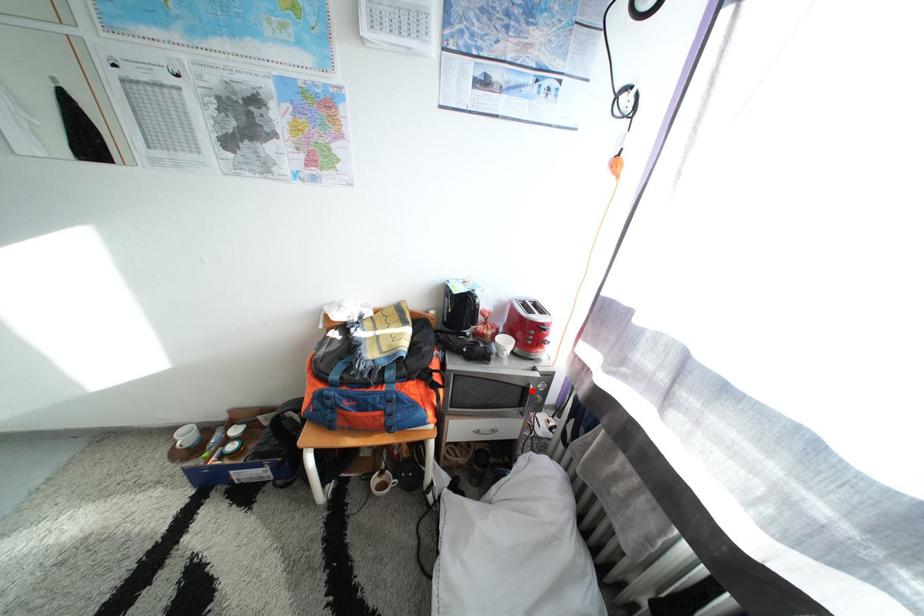
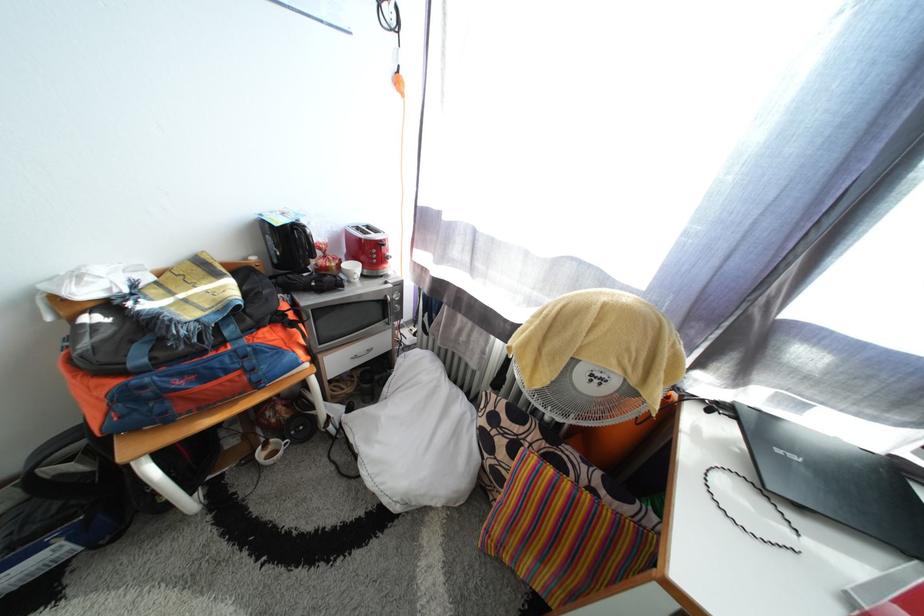
Question: I am providing you with two images of the same scene from different viewpoints. Given a red point in image1, look at the same physical point in image2. Is it:

Choices:
 (A) Closer to the viewpoint
 (B) Farther from the viewpoint

Answer: (A)